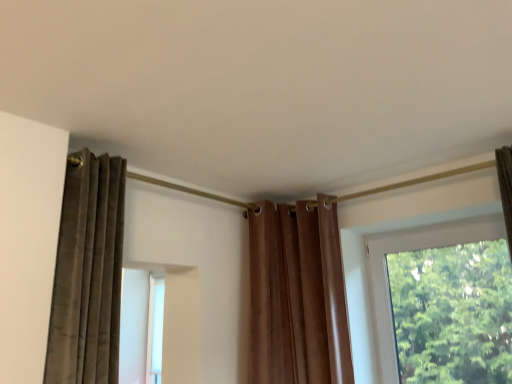
The width and height of the screenshot is (512, 384). What do you see at coordinates (297, 295) in the screenshot?
I see `brown velvet curtain at center` at bounding box center [297, 295].

Where is `brown velvet curtain at center`? Image resolution: width=512 pixels, height=384 pixels. brown velvet curtain at center is located at coordinates 297,295.

Describe the element at coordinates (415, 248) in the screenshot. I see `transparent glass window at right` at that location.

Locate an element on the screen. This screenshot has height=384, width=512. transparent glass window at right is located at coordinates (415, 248).

The width and height of the screenshot is (512, 384). I want to click on brown velvet curtain at center, so click(297, 295).

Would you say transparent glass window at right is to the left or to the right of brown velvet curtain at center in the picture?

Clearly, transparent glass window at right is on the right of brown velvet curtain at center in the image.

Is transparent glass window at right further to the viewer compared to brown velvet curtain at center?

No, transparent glass window at right is closer to the camera.

Is point (379, 296) in front of point (328, 350)?

No, it is not.

From the image's perspective, which one is positioned lower, transparent glass window at right or brown velvet curtain at center?

transparent glass window at right, from the image's perspective.

From a real-world perspective, who is located higher, transparent glass window at right or brown velvet curtain at center?

brown velvet curtain at center.

Looking at their sizes, would you say transparent glass window at right is wider or thinner than brown velvet curtain at center?

In the image, transparent glass window at right appears to be more narrow than brown velvet curtain at center.

Considering the sizes of objects transparent glass window at right and brown velvet curtain at center in the image provided, who is taller, transparent glass window at right or brown velvet curtain at center?

With more height is brown velvet curtain at center.

Looking at the image, does transparent glass window at right seem bigger or smaller compared to brown velvet curtain at center?

In the image, transparent glass window at right appears to be smaller than brown velvet curtain at center.

Consider the image. Can we say transparent glass window at right lies outside brown velvet curtain at center?

Indeed, transparent glass window at right is completely outside brown velvet curtain at center.

Based on the photo, is there a large distance between transparent glass window at right and brown velvet curtain at center?

transparent glass window at right is near brown velvet curtain at center, not far away.

Is transparent glass window at right facing away from brown velvet curtain at center?

No, brown velvet curtain at center is not at the back of transparent glass window at right.

At what (x,y) coordinates should I click in order to perform the action: click on window that is on the right side of brown velvet curtain at center. Please return your answer as a coordinate pair (x, y). This screenshot has width=512, height=384. Looking at the image, I should click on (415, 248).

Considering the positions of objects brown velvet curtain at center and transparent glass window at right in the image provided, who is more to the left, brown velvet curtain at center or transparent glass window at right?

Positioned to the left is brown velvet curtain at center.

Is brown velvet curtain at center further to the viewer compared to transparent glass window at right?

Yes, brown velvet curtain at center is further from the viewer.

Considering the positions of point (286, 266) and point (383, 364), is point (286, 266) closer or farther from the camera than point (383, 364)?

Point (286, 266).

From the image's perspective, who appears lower, brown velvet curtain at center or transparent glass window at right?

transparent glass window at right appears lower in the image.

From a real-world perspective, between brown velvet curtain at center and transparent glass window at right, who is vertically higher?

In real-world perspective, brown velvet curtain at center is above.

Considering the sizes of objects brown velvet curtain at center and transparent glass window at right in the image provided, who is wider, brown velvet curtain at center or transparent glass window at right?

brown velvet curtain at center is wider.

Who is shorter, brown velvet curtain at center or transparent glass window at right?

transparent glass window at right is shorter.

Based on their sizes in the image, would you say brown velvet curtain at center is bigger or smaller than transparent glass window at right?

Considering their sizes, brown velvet curtain at center takes up more space than transparent glass window at right.

Can transparent glass window at right be found inside brown velvet curtain at center?

No.

Are brown velvet curtain at center and transparent glass window at right beside each other?

brown velvet curtain at center is not next to transparent glass window at right, and they're not touching.

Is brown velvet curtain at center oriented towards transparent glass window at right?

No, brown velvet curtain at center is not oriented towards transparent glass window at right.

How far apart are brown velvet curtain at center and transparent glass window at right?

The distance of brown velvet curtain at center from transparent glass window at right is 18.06 inches.

Where is `window on the right of brown velvet curtain at center`? window on the right of brown velvet curtain at center is located at coordinates (415, 248).

The height and width of the screenshot is (384, 512). What are the coordinates of `curtain that appears above the transparent glass window at right (from the image's perspective)` in the screenshot? It's located at (297, 295).

Image resolution: width=512 pixels, height=384 pixels. I want to click on window on the right of brown velvet curtain at center, so click(x=415, y=248).